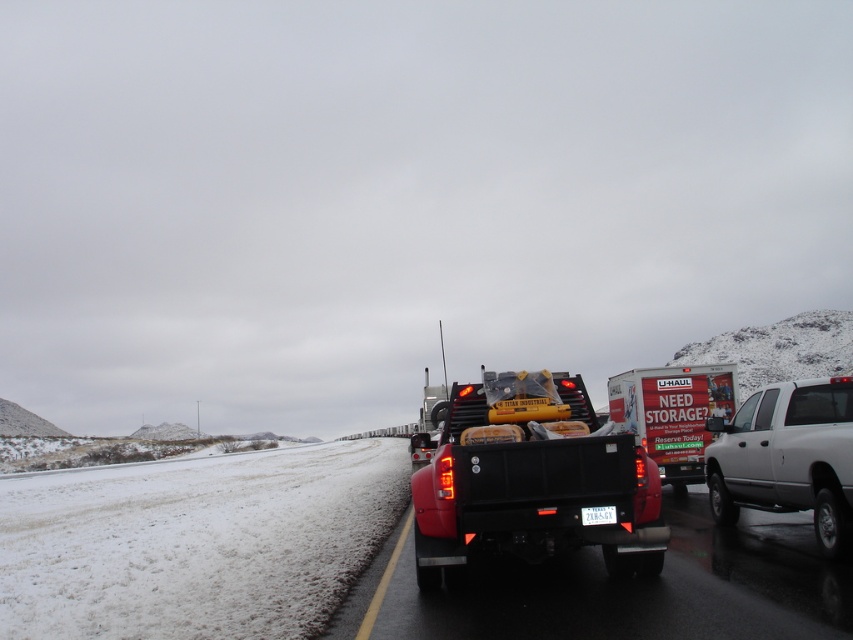
You are a delivery driver who needs to park your truck in this snowy area. You see a black matte truck at center and a white plastic license plate at center. Which vehicle is wider? Please answer based on the scene description.

The black matte truck at center is wider than the white plastic license plate at center.

You are a delivery driver who needs to park your vehicle in the same spot as the black matte truck at center. What coordinates should you aim for?

You should aim for the coordinates point (622, 589) where the black matte truck at center is located.

You are a delivery driver who needs to park your van between the black matte truck at center and the white matte pickup truck at right. Is there enough space between them for your van, which is 6 meters long?

The black matte truck at center is positioned on the left side of the white matte pickup truck at right. However, the exact distance between them is not provided in the scene description. Without knowing the distance, it is impossible to determine if there is enough space for a 6 meter van.